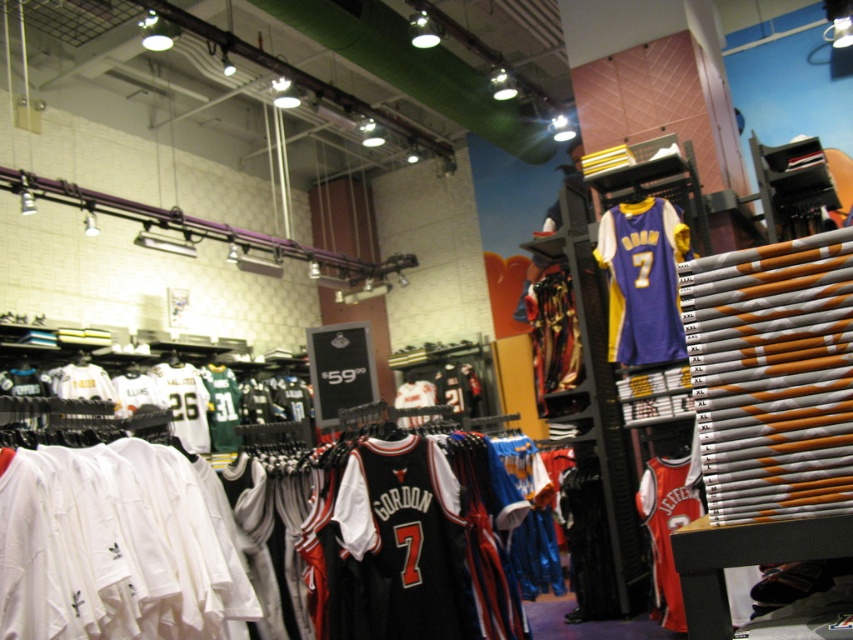
Question: Is black jersey at center above red jersey at center?

Choices:
 (A) yes
 (B) no

Answer: (A)

Question: Which point is closer to the camera?

Choices:
 (A) purple jersey at center
 (B) black jersey at center

Answer: (B)

Question: Which object is positioned farthest from the red jersey at center?

Choices:
 (A) black jersey at center
 (B) purple jersey at center

Answer: (A)

Question: Estimate the real-world distances between objects in this image. Which object is farther from the purple jersey at center?

Choices:
 (A) black jersey at center
 (B) red jersey at center

Answer: (A)

Question: Observing the image, what is the correct spatial positioning of black jersey at center in reference to purple jersey at center?

Choices:
 (A) right
 (B) left

Answer: (B)

Question: Is black jersey at center smaller than red jersey at center?

Choices:
 (A) yes
 (B) no

Answer: (A)